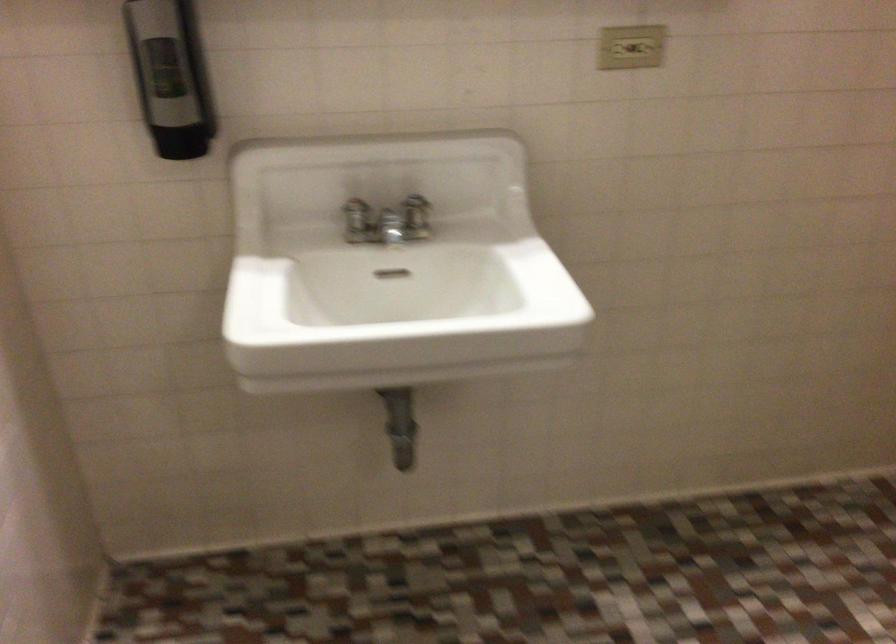
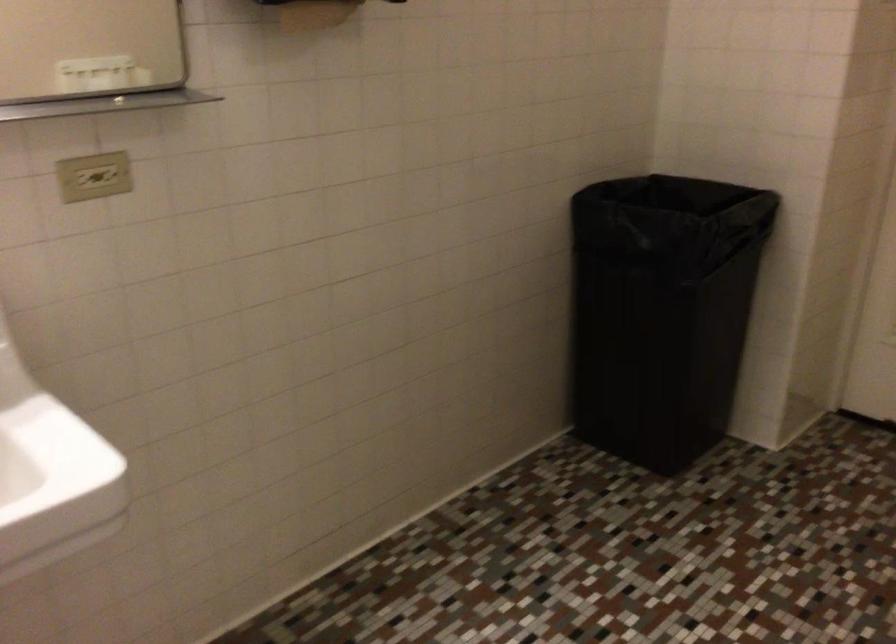
Question: The images are taken continuously from a first-person perspective. In which direction is your viewpoint rotating?

Choices:
 (A) Left
 (B) Right
 (C) Up
 (D) Down

Answer: (B)